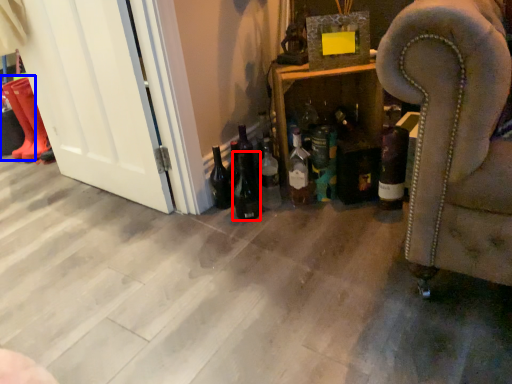
Question: Among these objects, which one is nearest to the camera, beer bottle (highlighted by a red box) or boot (highlighted by a blue box)?

Choices:
 (A) beer bottle
 (B) boot

Answer: (A)